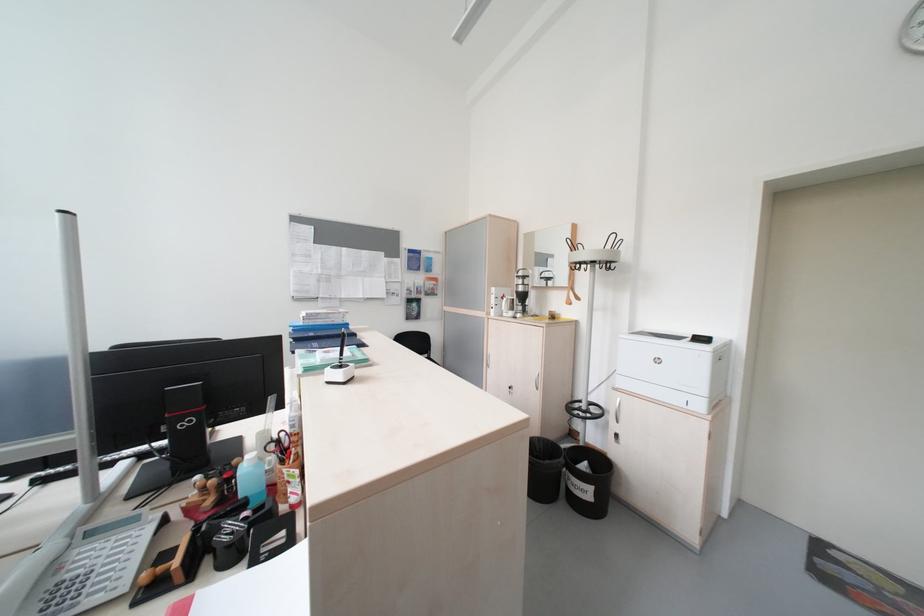
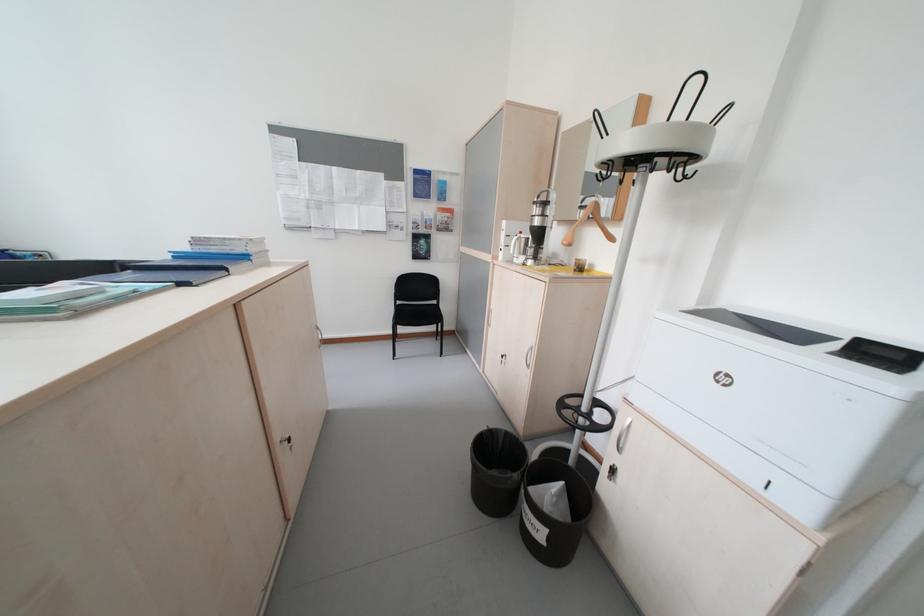
Question: The camera is either moving clockwise (left) or counter-clockwise (right) around the object. The first image is from the beginning of the video and the second image is from the end. Is the camera moving left or right when shooting the video?

Choices:
 (A) Left
 (B) Right

Answer: (B)